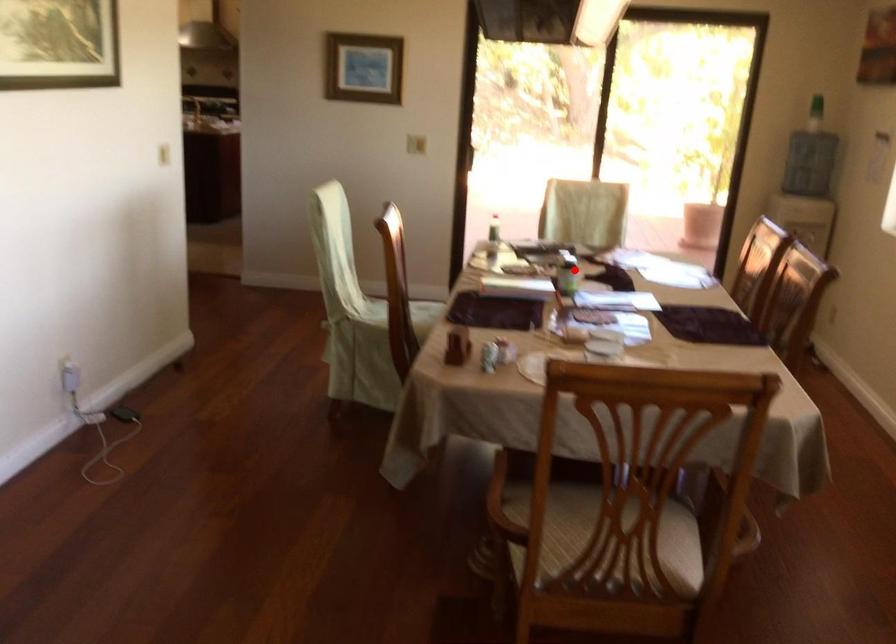
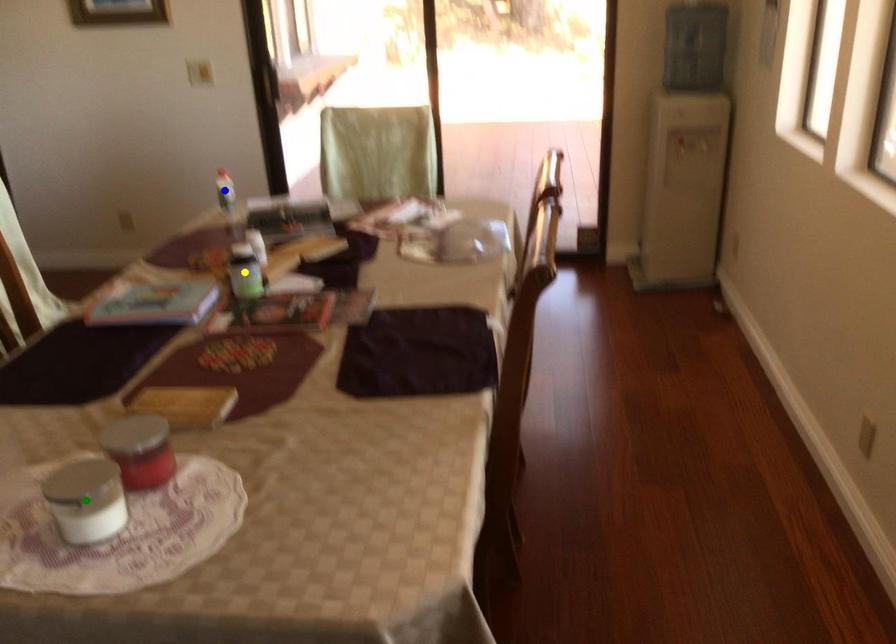
Question: I am providing you with two images of the same scene from different viewpoints. A red point is marked on the first image. You are given multiple points on the second image. Which mark in image 2 goes with the point in image 1?

Choices:
 (A) green point
 (B) blue point
 (C) yellow point

Answer: (C)